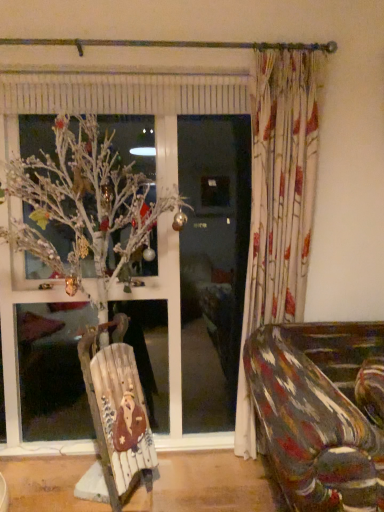
What do you see at coordinates (117, 410) in the screenshot?
I see `wooden sled at center` at bounding box center [117, 410].

Measure the distance between wooden sled at center and camera.

6.11 feet.

What is the approximate height of wooden sled at center?

The height of wooden sled at center is 34.05 inches.

Where is `wooden sled at center`? The image size is (384, 512). wooden sled at center is located at coordinates (117, 410).

Identify the location of wooden sled at center. (117, 410).